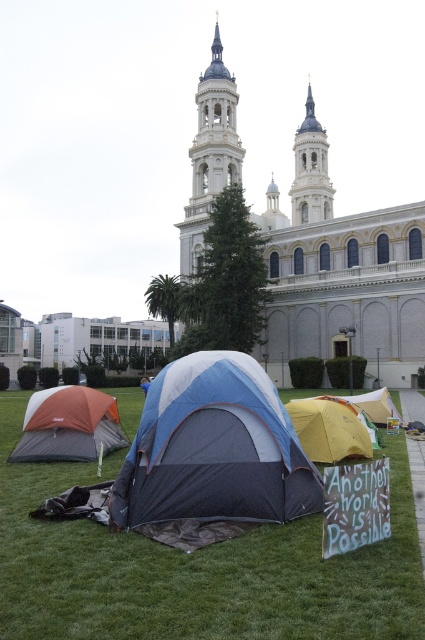
Question: Which object is closer to the camera taking this photo?

Choices:
 (A) green grass at center
 (B) orange fabric tent at lower left

Answer: (A)

Question: Estimate the real-world distances between objects in this image. Which object is farther from the yellow fabric tent at lower right?

Choices:
 (A) green grass at center
 (B) white stone church at center
 (C) yellow fabric tent at lower center

Answer: (B)

Question: From the image, what is the correct spatial relationship of white stone spire at upper center in relation to yellow fabric tent at lower right?

Choices:
 (A) left
 (B) right

Answer: (B)

Question: Can you confirm if green grass at center is positioned below white stone church at center?

Choices:
 (A) no
 (B) yes

Answer: (B)

Question: Can you confirm if blue/gray fabric tent at center is positioned below orange fabric tent at lower left?

Choices:
 (A) yes
 (B) no

Answer: (B)

Question: Which object is the closest to the white stone church at center?

Choices:
 (A) yellow fabric tent at lower center
 (B) yellow fabric tent at lower right
 (C) orange fabric tent at lower left

Answer: (B)